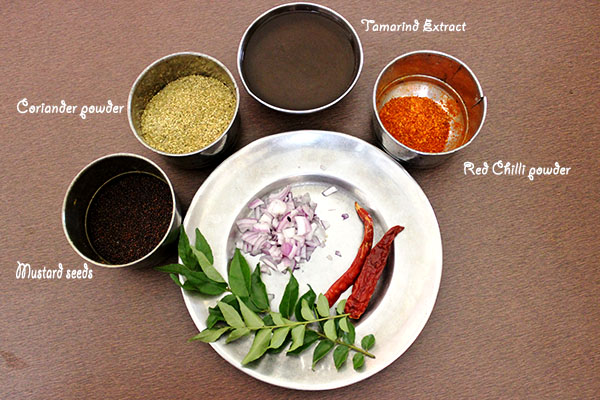
At what (x,y) coordinates should I click in order to perform the action: click on plate. Please return your answer as a coordinate pair (x, y). This screenshot has width=600, height=400. Looking at the image, I should click on (427, 260).